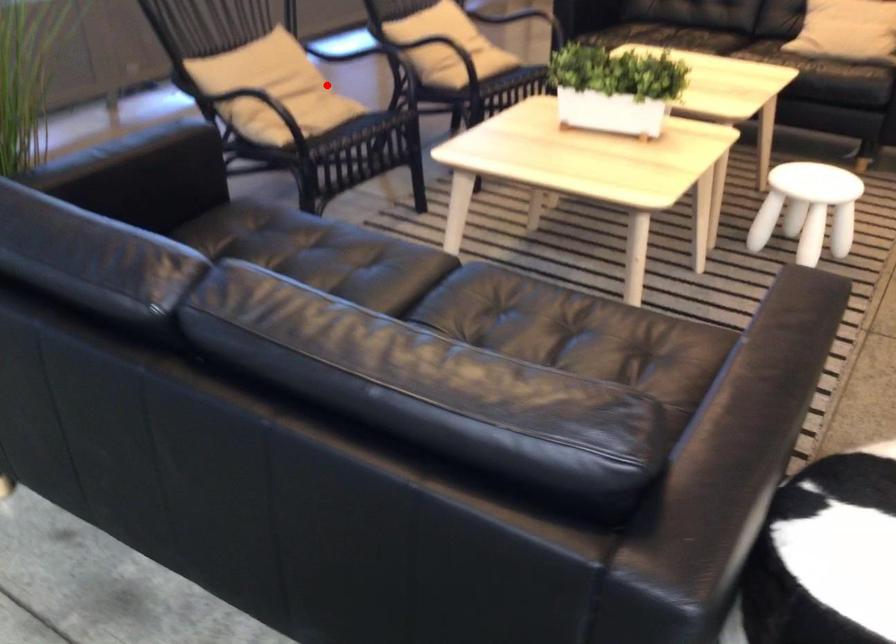
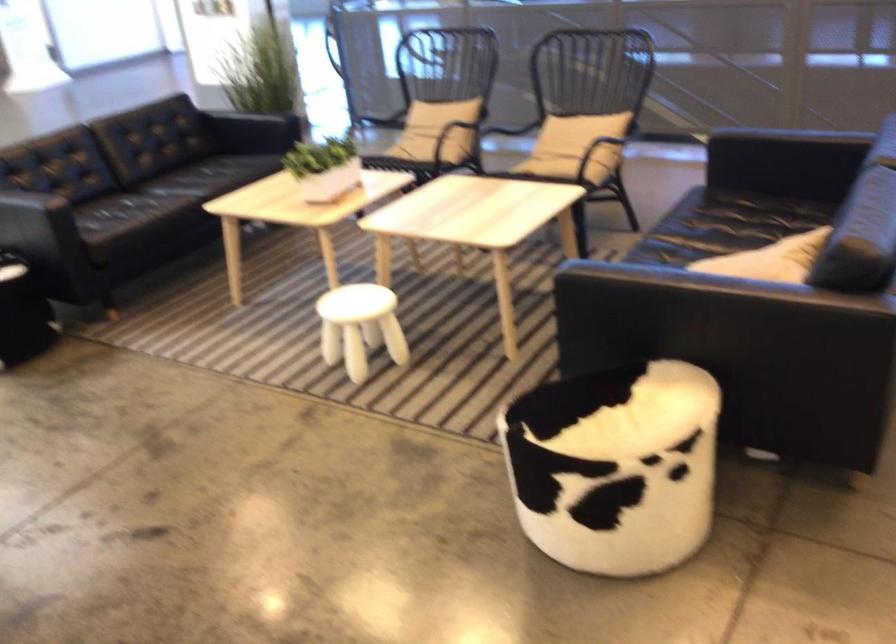
Question: I am providing you with two images of the same scene from different viewpoints. Image1 has a red point marked. In image2, the corresponding 3D location appears at what relative position? Reply with the corresponding letter.

Choices:
 (A) Closer
 (B) Farther

Answer: (B)